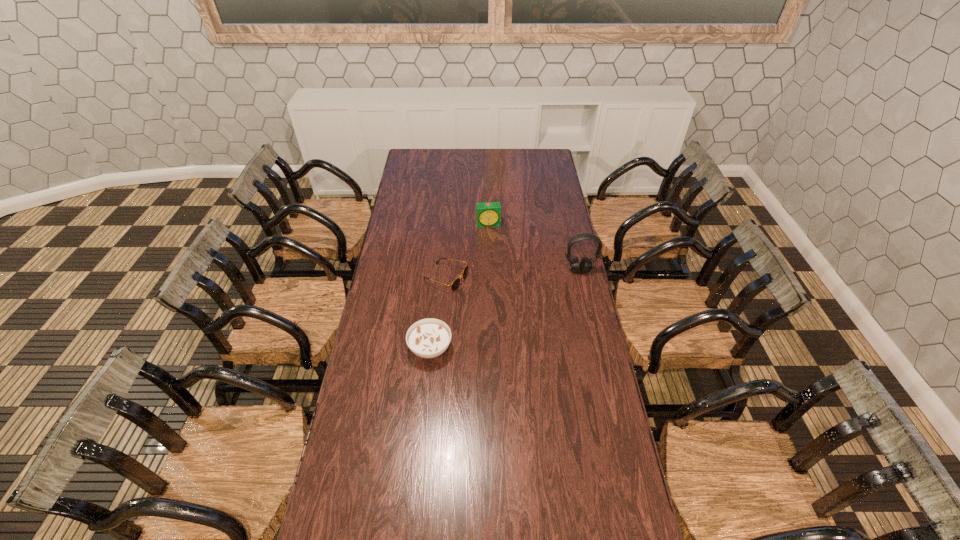
Where is `soup bowl`? soup bowl is located at coordinates (428, 338).

Image resolution: width=960 pixels, height=540 pixels. In order to click on the second shortest object in this screenshot , I will do `click(428, 338)`.

Where is `the tallest object`? the tallest object is located at coordinates (585, 266).

Locate an element on the screen. Image resolution: width=960 pixels, height=540 pixels. the rightmost object is located at coordinates (585, 266).

Image resolution: width=960 pixels, height=540 pixels. In order to click on the shortest object in this screenshot , I will do `click(455, 284)`.

At what (x,y) coordinates should I click in order to perform the action: click on the farthest object. Please return your answer as a coordinate pair (x, y). Looking at the image, I should click on (488, 214).

Locate an element on the screen. The image size is (960, 540). the third object from left to right is located at coordinates (488, 214).

Identify the location of vacant space located 0.070m on the left of the soup bowl. (390, 348).

Identify the location of vacant space located 0.320m on the front-facing side of the headset. This screenshot has width=960, height=540. (594, 333).

Identify the location of vacant space located 0.120m on the lenses of the shortest object. This screenshot has height=540, width=960. (490, 295).